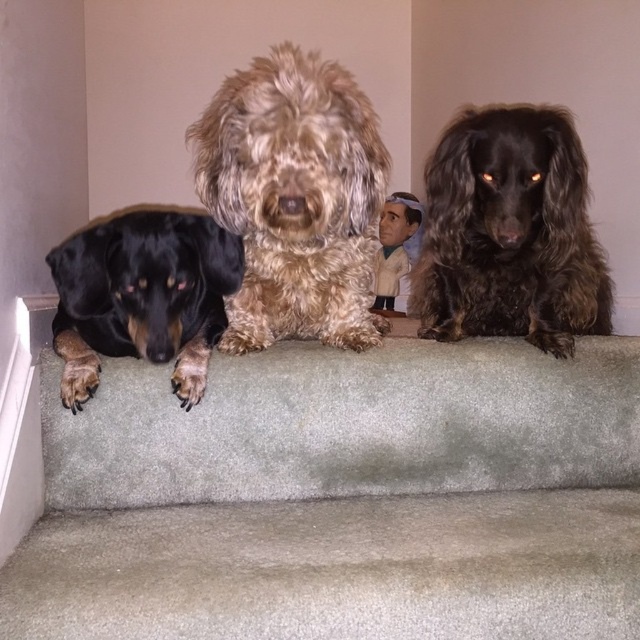
Question: Which object appears closest to the camera in this image?

Choices:
 (A) black matte dog at left
 (B) fuzzy brown dog at center
 (C) shiny brown fur at center
 (D) carpeted stairs at center

Answer: (D)

Question: Is carpeted stairs at center positioned at the back of black matte dog at left?

Choices:
 (A) no
 (B) yes

Answer: (A)

Question: Can you confirm if carpeted stairs at center is positioned below shiny brown fur at center?

Choices:
 (A) yes
 (B) no

Answer: (A)

Question: Based on their relative distances, which object is farther from the black matte dog at left?

Choices:
 (A) carpeted stairs at center
 (B) fuzzy brown dog at center

Answer: (A)

Question: Is carpeted stairs at center thinner than fuzzy brown dog at center?

Choices:
 (A) yes
 (B) no

Answer: (B)

Question: Which point is farther to the camera?

Choices:
 (A) (72, 333)
 (B) (566, 221)

Answer: (A)